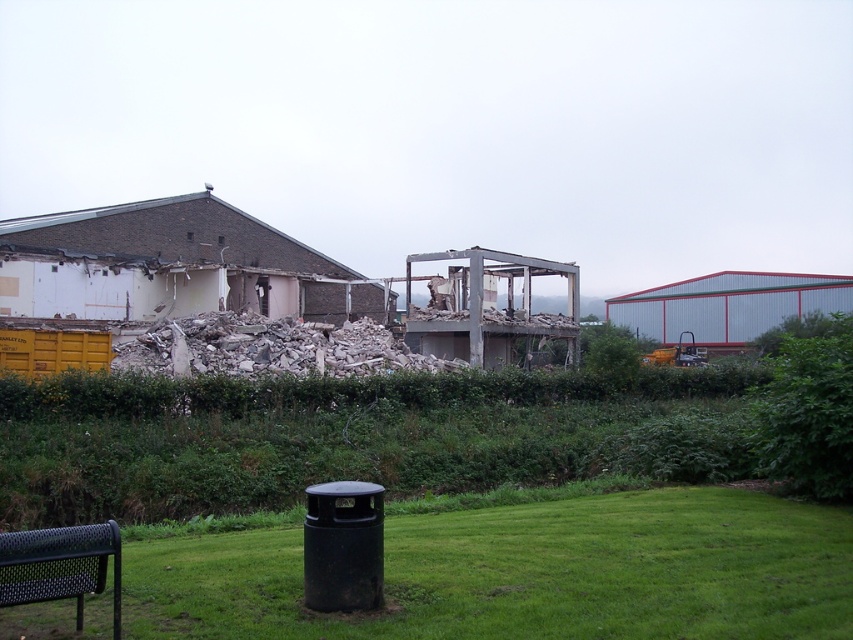
Question: Based on their relative distances, which object is farther from the green leafy hedge at lower right?

Choices:
 (A) green grass at lower center
 (B) black mesh park bench at lower left

Answer: (A)

Question: Which point is closer to the camera?

Choices:
 (A) green leafy hedge at lower right
 (B) green grass at lower center
 (C) black mesh park bench at lower left

Answer: (C)

Question: Among these objects, which one is nearest to the camera?

Choices:
 (A) green grass at lower center
 (B) green leafy hedge at lower right

Answer: (A)

Question: Where is green leafy hedge at lower right located in relation to black mesh park bench at lower left in the image?

Choices:
 (A) above
 (B) below

Answer: (A)

Question: Is green grass at lower center smaller than black mesh park bench at lower left?

Choices:
 (A) no
 (B) yes

Answer: (B)

Question: Is green grass at lower center below green leafy hedge at lower right?

Choices:
 (A) no
 (B) yes

Answer: (B)